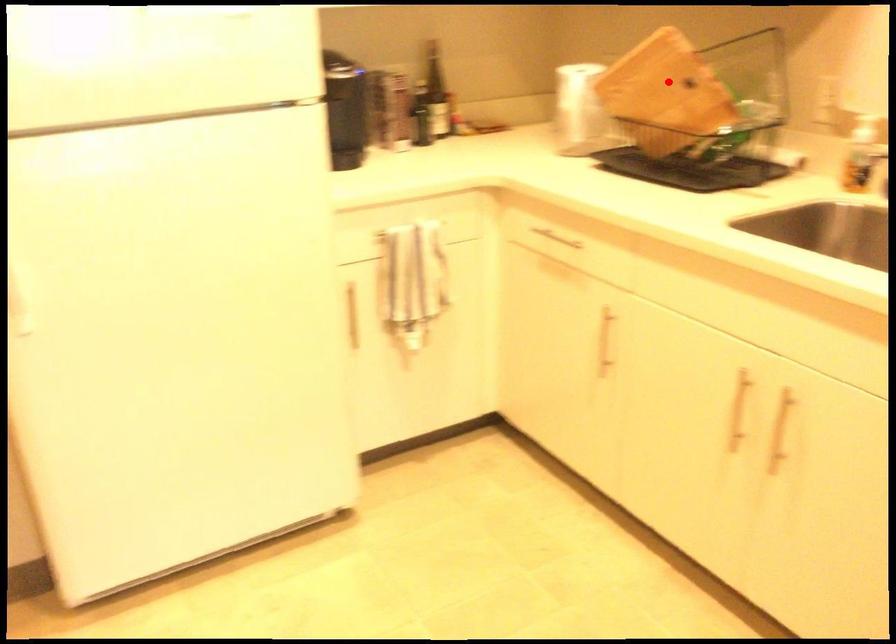
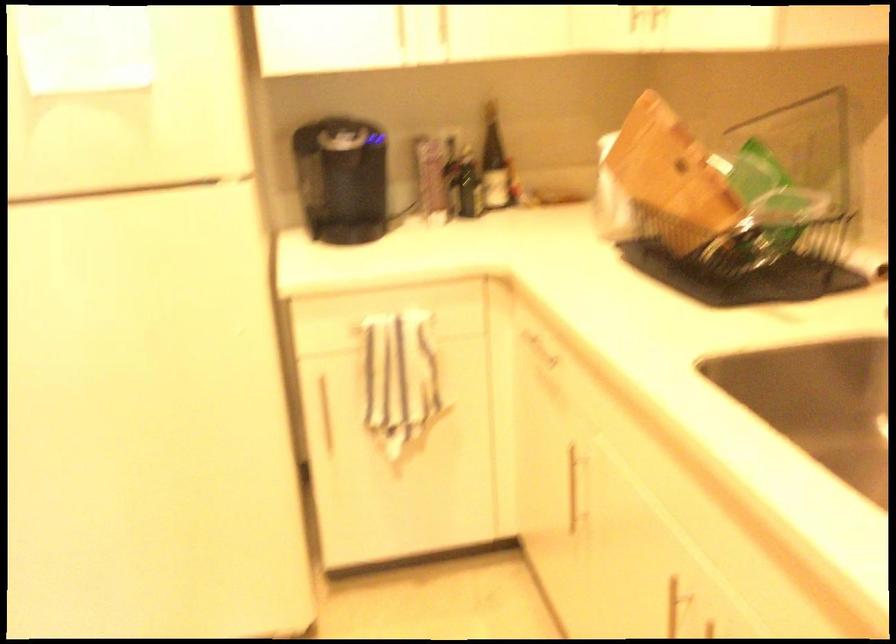
Find the pixel in the second image that matches the highlighted location in the first image.

(670, 167)